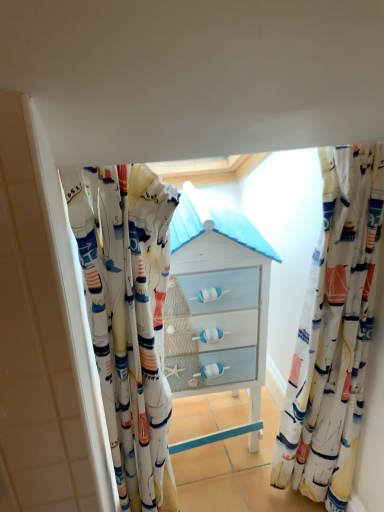
Question: Is white fabric curtain at center, marked as the 1th curtain in a left-to-right arrangement, to the right of matte white chest of drawers at center from the viewer's perspective?

Choices:
 (A) no
 (B) yes

Answer: (A)

Question: Is the depth of white fabric curtain at center, marked as the 1th curtain in a left-to-right arrangement, less than that of matte white chest of drawers at center?

Choices:
 (A) no
 (B) yes

Answer: (B)

Question: Is matte white chest of drawers at center located within white fabric curtain at center, marked as the 1th curtain in a left-to-right arrangement?

Choices:
 (A) yes
 (B) no

Answer: (B)

Question: Is white fabric curtain at center, marked as the 1th curtain in a left-to-right arrangement, wider than matte white chest of drawers at center?

Choices:
 (A) yes
 (B) no

Answer: (B)

Question: Is white fabric curtain at center, placed as the 2th curtain when sorted from right to left, smaller than matte white chest of drawers at center?

Choices:
 (A) no
 (B) yes

Answer: (B)

Question: In terms of width, does white fabric curtain at center, placed as the 2th curtain when sorted from right to left, look wider or thinner when compared to matte white chest of drawers at center?

Choices:
 (A) thin
 (B) wide

Answer: (A)

Question: Based on their sizes in the image, would you say white fabric curtain at center, marked as the 1th curtain in a left-to-right arrangement, is bigger or smaller than matte white chest of drawers at center?

Choices:
 (A) small
 (B) big

Answer: (A)

Question: Considering the positions of white fabric curtain at center, marked as the 1th curtain in a left-to-right arrangement, and matte white chest of drawers at center in the image, is white fabric curtain at center, marked as the 1th curtain in a left-to-right arrangement, taller or shorter than matte white chest of drawers at center?

Choices:
 (A) tall
 (B) short

Answer: (A)

Question: Is white fabric curtain at center, marked as the 1th curtain in a left-to-right arrangement, in front of or behind matte white chest of drawers at center in the image?

Choices:
 (A) front
 (B) behind

Answer: (A)

Question: Considering the positions of sailboat-patterned fabric at right, which appears as the 1th curtain when viewed from the right, and white fabric curtain at center, marked as the 1th curtain in a left-to-right arrangement, in the image, is sailboat-patterned fabric at right, which appears as the 1th curtain when viewed from the right, wider or thinner than white fabric curtain at center, marked as the 1th curtain in a left-to-right arrangement,?

Choices:
 (A) thin
 (B) wide

Answer: (A)

Question: Looking at the image, does sailboat-patterned fabric at right, which appears as the 1th curtain when viewed from the right, seem bigger or smaller compared to white fabric curtain at center, marked as the 1th curtain in a left-to-right arrangement?

Choices:
 (A) big
 (B) small

Answer: (B)

Question: Considering the positions of point (327, 152) and point (86, 271), is point (327, 152) closer or farther from the camera than point (86, 271)?

Choices:
 (A) farther
 (B) closer

Answer: (A)

Question: Considering their positions, is sailboat-patterned fabric at right, which appears as the 1th curtain when viewed from the right, located in front of or behind white fabric curtain at center, placed as the 2th curtain when sorted from right to left?

Choices:
 (A) behind
 (B) front

Answer: (A)

Question: From the image's perspective, is white fabric curtain at center, placed as the 2th curtain when sorted from right to left, located above or below sailboat-patterned fabric at right, which ranks as the second curtain in left-to-right order?

Choices:
 (A) below
 (B) above

Answer: (A)

Question: Looking at their shapes, would you say white fabric curtain at center, marked as the 1th curtain in a left-to-right arrangement, is wider or thinner than sailboat-patterned fabric at right, which ranks as the second curtain in left-to-right order?

Choices:
 (A) wide
 (B) thin

Answer: (A)